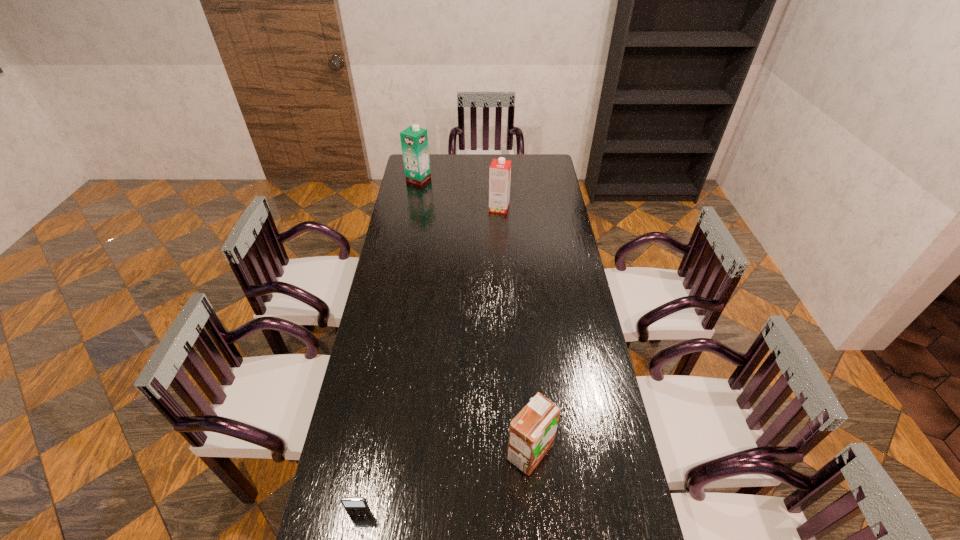
The image size is (960, 540). Find the location of `free spot located 0.340m on the straw side of the third farthest object`. free spot located 0.340m on the straw side of the third farthest object is located at coordinates (391, 452).

Image resolution: width=960 pixels, height=540 pixels. Find the location of `free space located 0.280m on the straw side of the third farthest object`. free space located 0.280m on the straw side of the third farthest object is located at coordinates (411, 452).

Where is `object that is at the far edge`? Image resolution: width=960 pixels, height=540 pixels. object that is at the far edge is located at coordinates (414, 140).

Where is `carton that is at the left edge`? The width and height of the screenshot is (960, 540). carton that is at the left edge is located at coordinates (414, 140).

Locate an element on the screen. iPod situated at the left edge is located at coordinates (353, 505).

The width and height of the screenshot is (960, 540). Identify the location of object located at the far left corner. (414, 140).

You are a GUI agent. You are given a task and a screenshot of the screen. Output one action in this format:
    pyautogui.click(x=<x>, y=<y>)
    Task: Click on the vacant space at the far edge of the desktop
    The width and height of the screenshot is (960, 540).
    Given the screenshot: What is the action you would take?
    pyautogui.click(x=480, y=160)

In order to click on free point at the left edge in this screenshot , I will do `click(395, 410)`.

In the image, there is a desktop. Identify the location of free space at the right edge. This screenshot has height=540, width=960. (568, 324).

Locate an element on the screen. This screenshot has height=540, width=960. free space at the far right corner of the desktop is located at coordinates (533, 159).